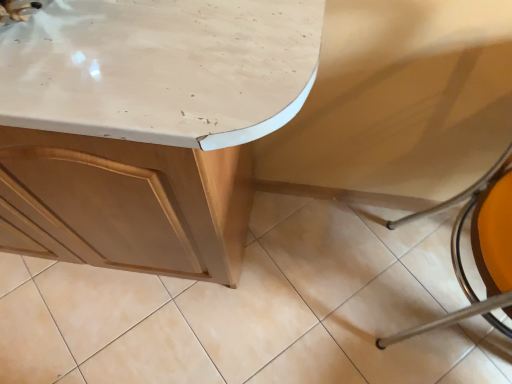
Question: Should I look upward or downward to see matte wood cabinet at center?

Choices:
 (A) up
 (B) down

Answer: (A)